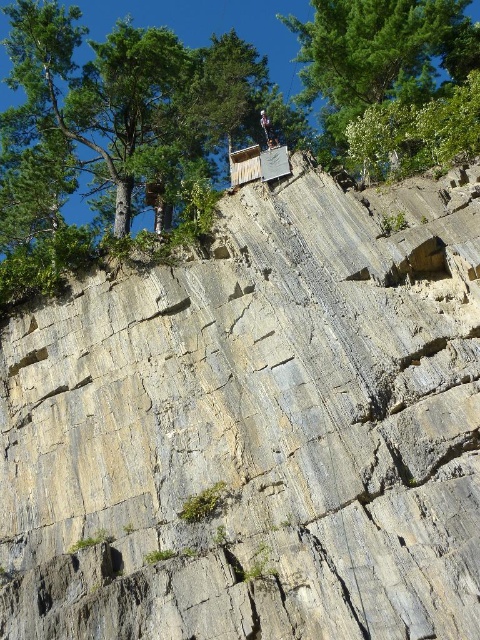
You are a hiker planning to climb the cliff and see the green leafy tree at upper center and the gray fabric rock climber at upper center. Which object is bigger in size?

The green leafy tree at upper center is larger in size than the gray fabric rock climber at upper center.

You are a hiker planning to climb the cliff. You see the green leafy tree at upper center and the wooden platform at the top. How far apart are these two landmarks?

The green leafy tree at upper center and the wooden platform at the top are 80.56 meters apart.

You are standing at the base of the cliff and want to locate the gray fabric rock climber at upper center. Which direction should you look relative to the green leafy tree at upper center?

The green leafy tree at upper center is to the right of the gray fabric rock climber at upper center, so you should look to the left of the green leafy tree at upper center to find the gray fabric rock climber at upper center.